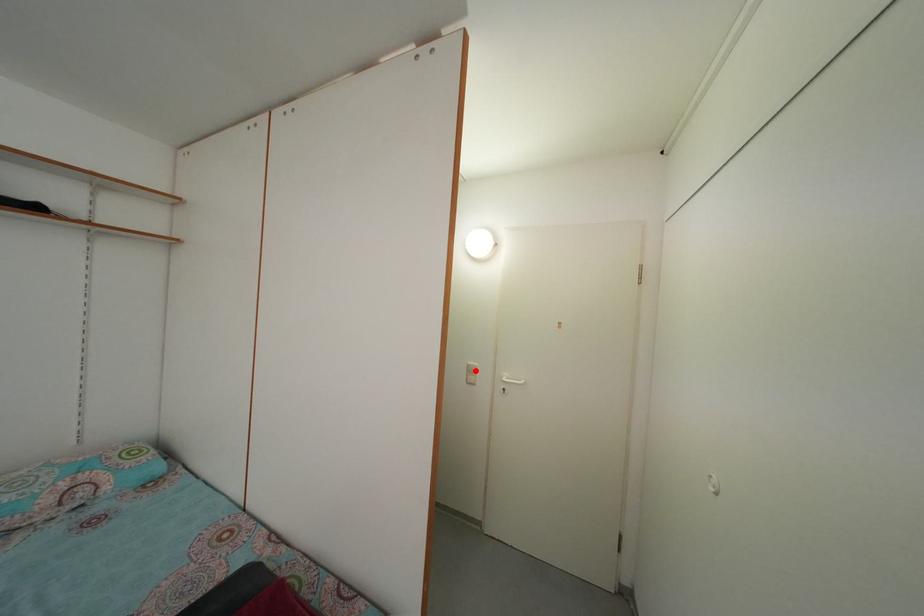
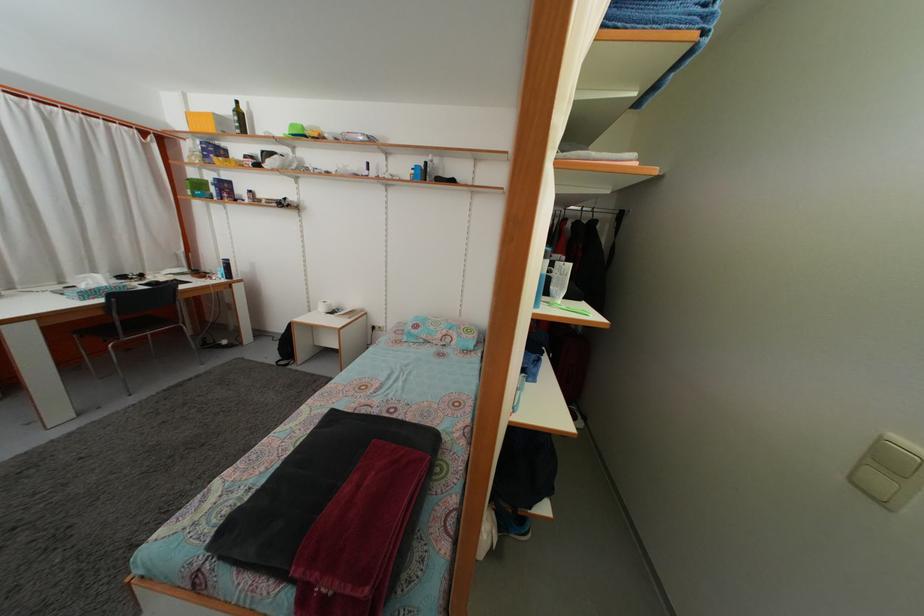
Where in the second image is the point corresponding to the highlighted location from the first image?

(903, 445)